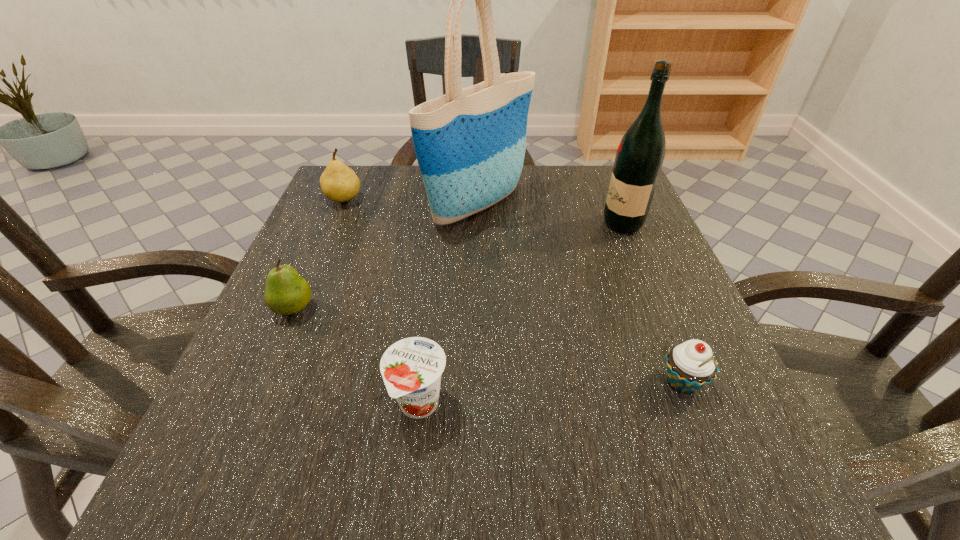
I want to click on cupcake that is positioned at the right edge, so click(x=690, y=366).

Locate an element on the screen. The height and width of the screenshot is (540, 960). object that is positioned at the far left corner is located at coordinates (339, 183).

The height and width of the screenshot is (540, 960). Find the location of `object that is at the far right corner`. object that is at the far right corner is located at coordinates [640, 155].

What are the coordinates of `vacant space at the far edge of the desktop` in the screenshot? It's located at (561, 185).

This screenshot has width=960, height=540. What are the coordinates of `free point at the left edge` in the screenshot? It's located at (235, 410).

Locate an element on the screen. free region at the right edge of the desktop is located at coordinates (597, 278).

The width and height of the screenshot is (960, 540). In the image, there is a desktop. What are the coordinates of `vacant space at the far left corner` in the screenshot? It's located at (391, 195).

Find the location of a particular element. free space at the far right corner of the desktop is located at coordinates (568, 170).

Locate an element on the screen. This screenshot has height=540, width=960. vacant space at the near right corner of the desktop is located at coordinates (689, 442).

Where is `free space between the second tallest object and the yogurt`? This screenshot has width=960, height=540. free space between the second tallest object and the yogurt is located at coordinates (521, 314).